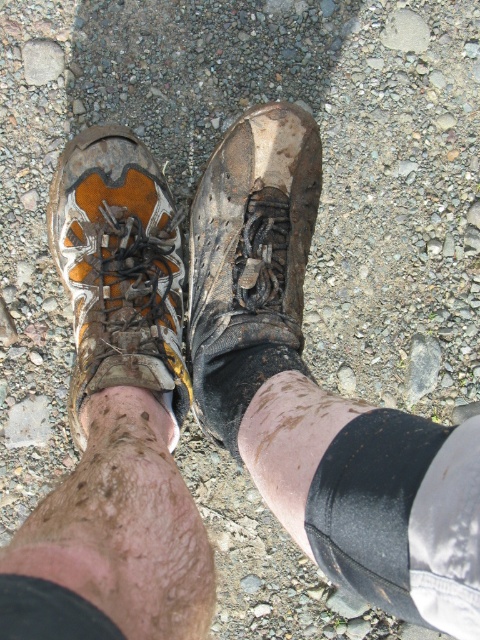
Is dirty leather boot at center to the right of black matte/soft fabric at lower center from the viewer's perspective?

In fact, dirty leather boot at center is to the left of black matte/soft fabric at lower center.

Does point (230, 198) come closer to viewer compared to point (360, 499)?

No, it is behind (360, 499).

I want to click on dirty leather boot at center, so click(250, 260).

Image resolution: width=480 pixels, height=640 pixels. Identify the location of dirty leather boot at center. (250, 260).

Does dirty leather boot at center have a lesser width compared to black fabric at lower center?

No, dirty leather boot at center is not thinner than black fabric at lower center.

The height and width of the screenshot is (640, 480). Describe the element at coordinates (250, 260) in the screenshot. I see `dirty leather boot at center` at that location.

At what (x,y) coordinates should I click in order to perform the action: click on dirty leather boot at center. Please return your answer as a coordinate pair (x, y). Looking at the image, I should click on (250, 260).

Who is positioned more to the right, orange suede boot at left or black fabric at lower center?

From the viewer's perspective, black fabric at lower center appears more on the right side.

Is the position of orange suede boot at left more distant than that of black fabric at lower center?

Yes.

Does point (149, 288) come farther from viewer compared to point (76, 616)?

Yes, point (149, 288) is behind point (76, 616).

Where is `orange suede boot at left`? Image resolution: width=480 pixels, height=640 pixels. orange suede boot at left is located at coordinates (120, 269).